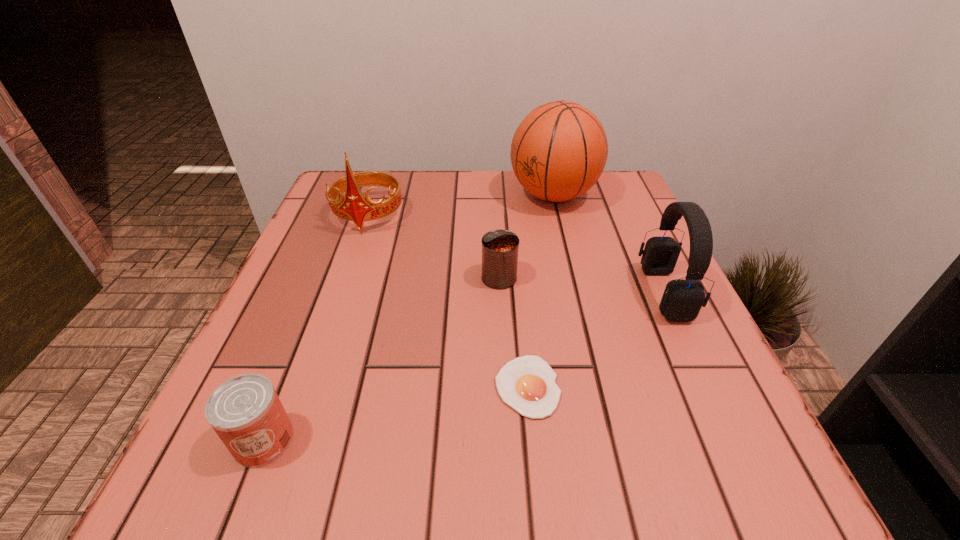
The width and height of the screenshot is (960, 540). Find the location of `the third closest object to the right can`. the third closest object to the right can is located at coordinates (355, 207).

Find the location of `free space that satisfies the following two spatial constraints: 1. on the front-facing side of the tiara; 2. on the left side of the taller can`. free space that satisfies the following two spatial constraints: 1. on the front-facing side of the tiara; 2. on the left side of the taller can is located at coordinates (347, 278).

Identify the location of vacant space that satisfies the following two spatial constraints: 1. on the front-facing side of the third shortest object; 2. on the right side of the tiara. The height and width of the screenshot is (540, 960). (347, 278).

I want to click on vacant region that satisfies the following two spatial constraints: 1. on the back side of the basketball; 2. on the right side of the shortest object, so click(509, 195).

The height and width of the screenshot is (540, 960). Identify the location of vacant space that satisfies the following two spatial constraints: 1. on the front-facing side of the tiara; 2. on the right side of the egg yolk. (309, 386).

The height and width of the screenshot is (540, 960). Identify the location of vacant area that satisfies the following two spatial constraints: 1. on the back side of the nearer can; 2. on the left side of the third shortest object. point(327,278).